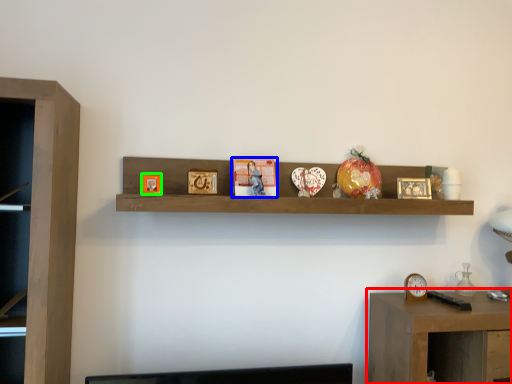
Question: Which is farther away from table (highlighted by a red box)? book (highlighted by a blue box) or picture frame (highlighted by a green box)?

Choices:
 (A) book
 (B) picture frame

Answer: (B)